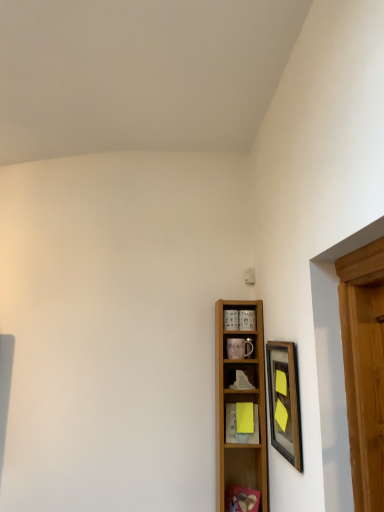
Question: Considering their positions, is yellow paper at center, the 3th shelf viewed from the top, located in front of or behind wooden framed picture at right?

Choices:
 (A) front
 (B) behind

Answer: (B)

Question: Is point (231, 403) closer or farther from the camera than point (292, 437)?

Choices:
 (A) farther
 (B) closer

Answer: (A)

Question: Estimate the real-world distances between objects in this image. Which object is closer to the wooden shelf at center, the second shelf viewed from the top?

Choices:
 (A) wooden framed picture at right
 (B) yellow paper at center, which is the 1th shelf from bottom to top
 (C) wooden shelf at center, the first shelf in the top-to-bottom sequence

Answer: (B)

Question: Estimate the real-world distances between objects in this image. Which object is closer to the yellow paper at center, the 3th shelf viewed from the top?

Choices:
 (A) wooden shelf at center, placed as the second shelf when sorted from bottom to top
 (B) wooden framed picture at right
 (C) wooden shelf at center, the third shelf ordered from the bottom

Answer: (A)